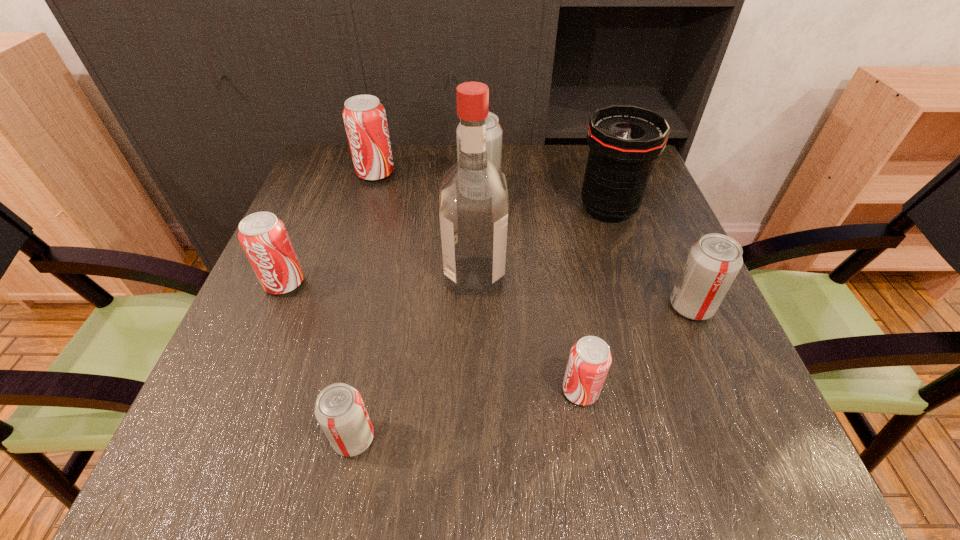
This screenshot has width=960, height=540. Find the location of `free space at the far edge of the desktop`. free space at the far edge of the desktop is located at coordinates (534, 166).

Find the location of a particular element. This screenshot has width=960, height=540. blank space at the near edge is located at coordinates (554, 491).

I want to click on vacant space at the left edge, so click(x=295, y=242).

In order to click on vacant area at the right edge in this screenshot , I will do `click(635, 237)`.

What are the coordinates of `free spot at the far left corner of the desktop` in the screenshot? It's located at (324, 145).

The width and height of the screenshot is (960, 540). Find the location of `free space at the far right corner`. free space at the far right corner is located at coordinates (651, 192).

Identify the location of free spot between the second smallest red soda can and the seventh object from right to left. (330, 228).

I want to click on empty space between the sixth object from right to left and the telephoto lens, so click(x=481, y=323).

Where is `free spot between the second biggest gray soda can and the telephoto lens`? The image size is (960, 540). free spot between the second biggest gray soda can and the telephoto lens is located at coordinates pyautogui.click(x=650, y=258).

Image resolution: width=960 pixels, height=540 pixels. I want to click on vacant space that's between the nearest red soda can and the tallest object, so [x=528, y=333].